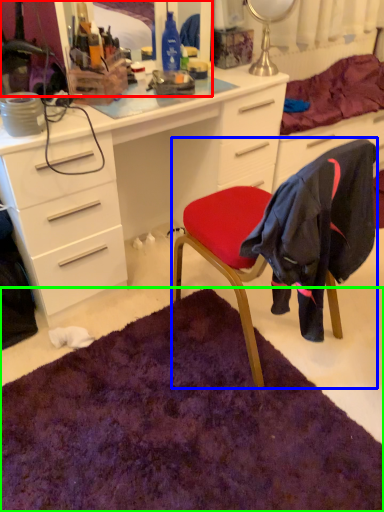
Question: Which object is positioned closest to mirror (highlighted by a red box)? Select from chair (highlighted by a blue box) and mat (highlighted by a green box).

Choices:
 (A) chair
 (B) mat

Answer: (A)